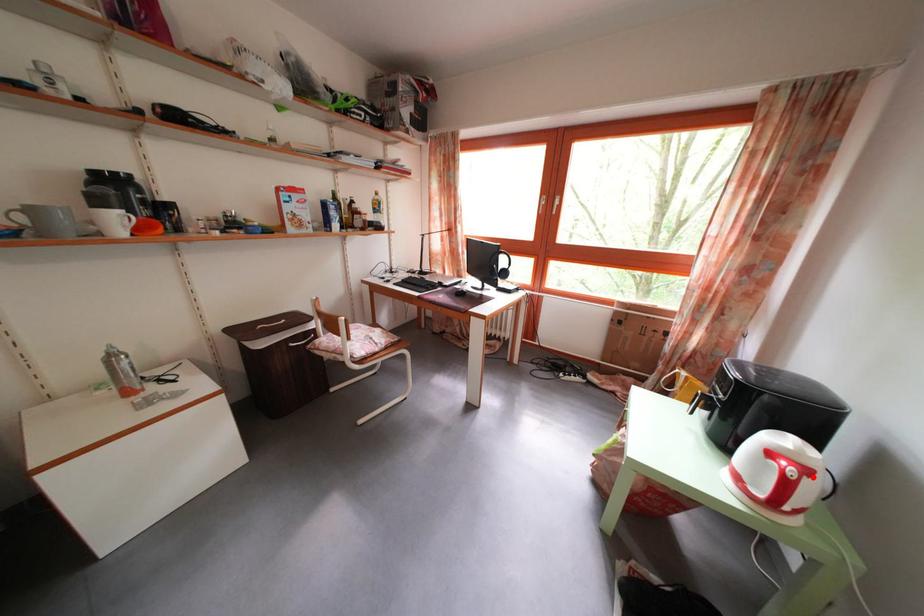
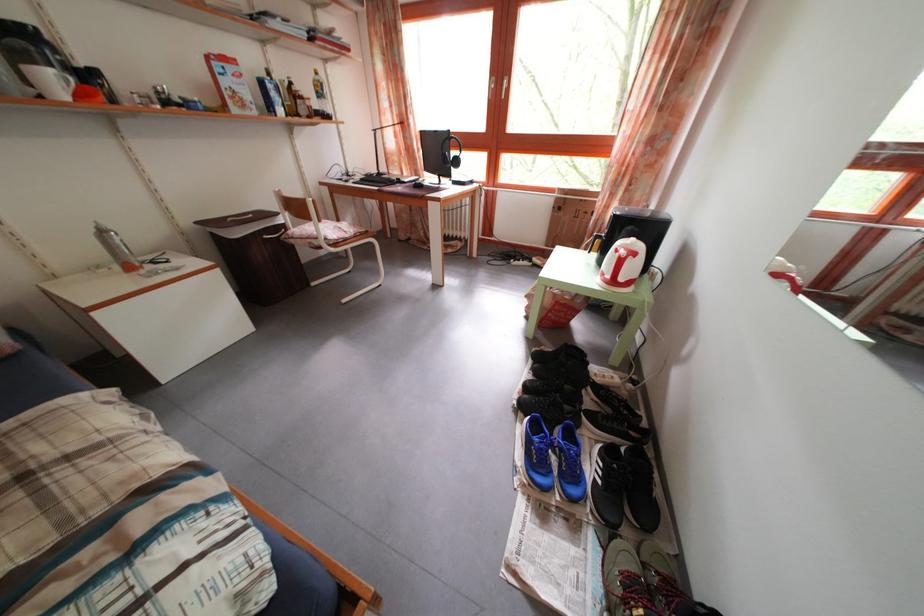
The point at the highlighted location is marked in the first image. Where is the corresponding point in the second image?

(641, 262)